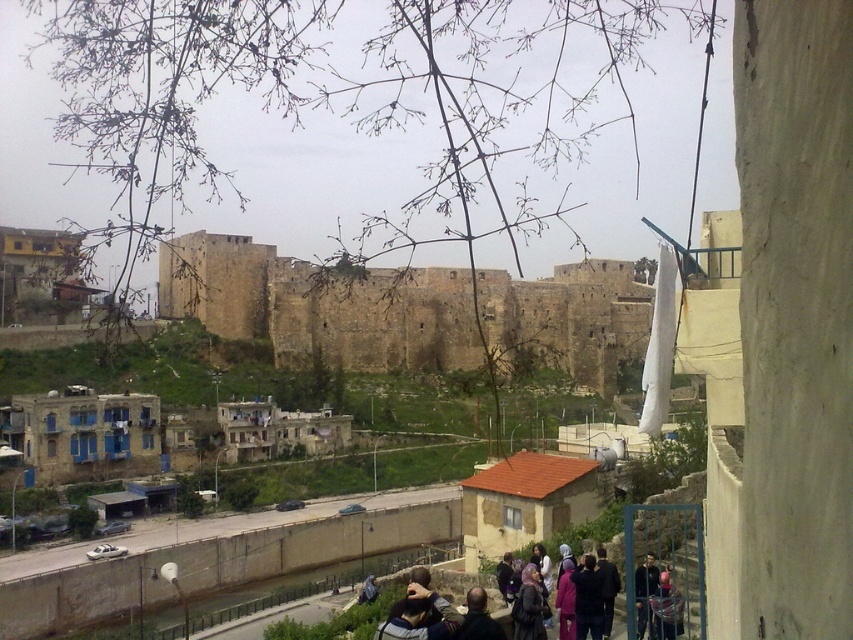
You are standing at the top of the fortress and want to signal to the people below. Which object is closer to you, the brown stone fort at center or the dark blue jacket at lower right?

The brown stone fort at center is closer to you because it is in front of the dark blue jacket at lower right.

You are standing at the elevated vantage point overlooking the fortress and settlement. There are two points marked in the image. The first is at coordinates point (289, 321) and the second at point (653, 579). Which of these two points is closer to your current position?

Point (289, 321) is further to the camera than point (653, 579). Therefore, point (653, 579) is closer to your current position.